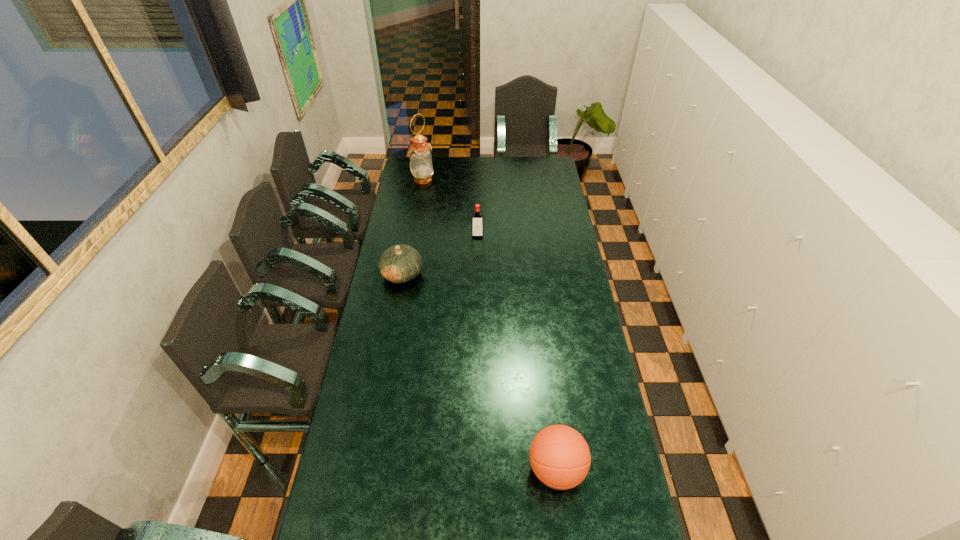
This screenshot has width=960, height=540. Identify the location of the tallest object. (421, 166).

Where is `oil lamp`? Image resolution: width=960 pixels, height=540 pixels. oil lamp is located at coordinates (421, 166).

Where is `vodka`? The image size is (960, 540). vodka is located at coordinates (477, 227).

In order to click on the third nearest object in this screenshot , I will do `click(477, 227)`.

Locate an element on the screen. Image resolution: width=960 pixels, height=540 pixels. basketball is located at coordinates (560, 458).

Find the location of a particular element. The image size is (960, 540). the nearest object is located at coordinates (560, 458).

At what (x,y) coordinates should I click in order to perform the action: click on gourd. Please return your answer as a coordinate pair (x, y). This screenshot has height=540, width=960. Looking at the image, I should click on (400, 263).

I want to click on the second nearest object, so click(400, 263).

Identify the location of vacant area located on the front of the oil lamp. This screenshot has width=960, height=540. (416, 222).

You are a GUI agent. You are given a task and a screenshot of the screen. Output one action in this format:
    pyautogui.click(x=<x>, y=<y>)
    Task: Click on the vacant point located on the front and back of the vodka
    
    Given the screenshot: What is the action you would take?
    pyautogui.click(x=477, y=297)